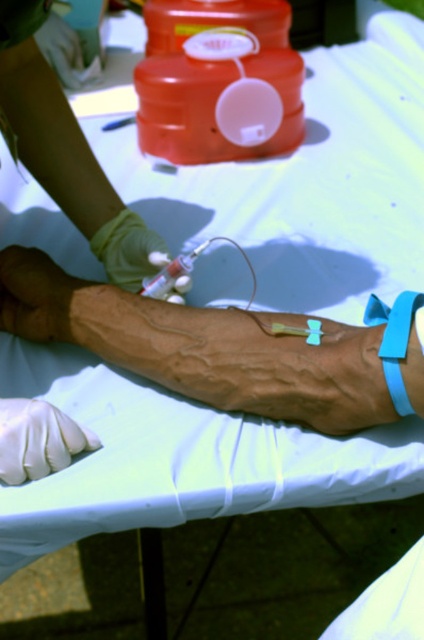
Does blue rubber band at lower right lie in front of translucent plastic syringe at center?

Yes, it is.

Measure the distance between blue rubber band at lower right and camera.

blue rubber band at lower right and camera are 26.05 inches apart from each other.

What are the coordinates of `blue rubber band at lower right` in the screenshot? It's located at (395, 340).

Is brown skin at center bigger than smooth green glove at upper left?

Yes.

Is brown skin at center thinner than smooth green glove at upper left?

No.

The image size is (424, 640). Describe the element at coordinates (203, 348) in the screenshot. I see `brown skin at center` at that location.

Locate an element on the screen. This screenshot has width=424, height=640. brown skin at center is located at coordinates (203, 348).

Consider the image. Does brown skin at center appear under green rubber glove at upper left?

Indeed, brown skin at center is positioned under green rubber glove at upper left.

Between brown skin at center and green rubber glove at upper left, which one is positioned lower?

brown skin at center

You are a GUI agent. You are given a task and a screenshot of the screen. Output one action in this format:
    pyautogui.click(x=<x>, y=<y>)
    Task: Click on the brown skin at center
    The image size is (424, 640).
    Given the screenshot: What is the action you would take?
    pyautogui.click(x=203, y=348)

The image size is (424, 640). What are the coordinates of `brown skin at center` in the screenshot? It's located at (203, 348).